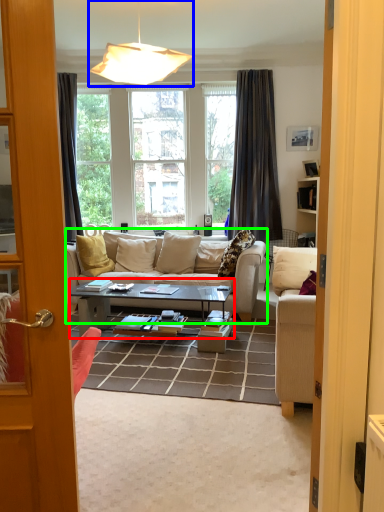
Question: Which is farther away from coffee table (highlighted by a red box)? lamp (highlighted by a blue box) or studio couch (highlighted by a green box)?

Choices:
 (A) lamp
 (B) studio couch

Answer: (A)